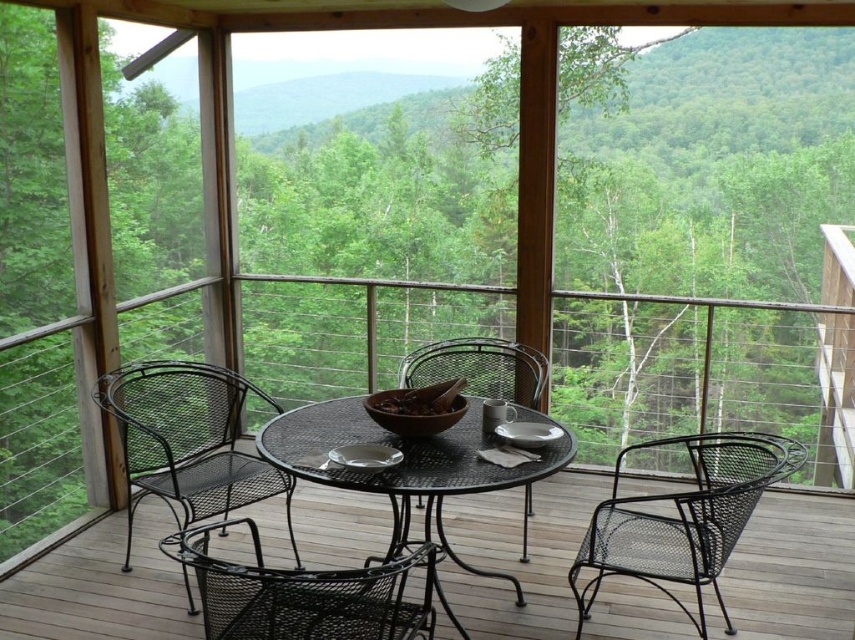
From the picture: Can you confirm if black mesh chair at lower right is shorter than black wire mesh chair at center?

No, black mesh chair at lower right is not shorter than black wire mesh chair at center.

Between black mesh chair at lower right and black wire mesh chair at center, which one is positioned higher?

black wire mesh chair at center

Which is behind, point (611, 522) or point (486, 368)?

Positioned behind is point (486, 368).

Locate an element on the screen. Image resolution: width=855 pixels, height=640 pixels. black mesh chair at lower right is located at coordinates (684, 518).

Between black metal table at center and black wire mesh chair at center, which one has more height?

With more height is black metal table at center.

Which is more to the right, black metal table at center or black wire mesh chair at center?

black wire mesh chair at center

You are a GUI agent. You are given a task and a screenshot of the screen. Output one action in this format:
    pyautogui.click(x=<x>, y=<y>)
    Task: Click on the black metal table at center
    The image size is (855, 640).
    Given the screenshot: What is the action you would take?
    pyautogui.click(x=405, y=465)

Is black mesh chair at lower right shorter than black metal table at center?

Correct, black mesh chair at lower right is not as tall as black metal table at center.

Is black mesh chair at lower right to the right of black metal table at center from the viewer's perspective?

Yes, black mesh chair at lower right is to the right of black metal table at center.

Is point (690, 506) in front of point (445, 456)?

That is True.

Image resolution: width=855 pixels, height=640 pixels. In order to click on black mesh chair at lower right in this screenshot , I will do `click(684, 518)`.